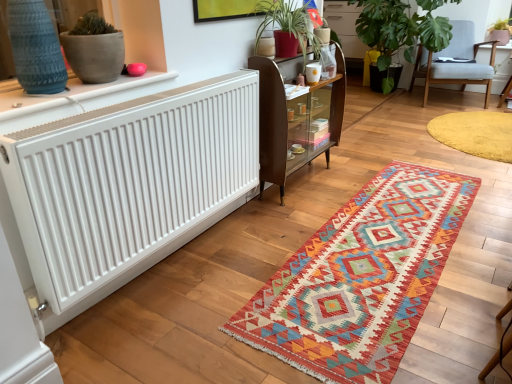
Identify the location of free area below yellow plush rug at lower right, which is the 1th mat from top to bottom (from a real-world perspective). (479, 124).